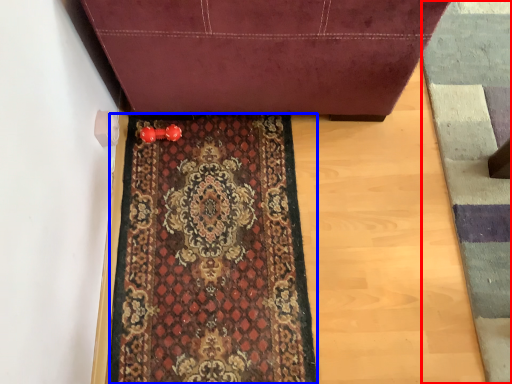
Question: Which object is further to the camera taking this photo, doormat (highlighted by a red box) or mat (highlighted by a blue box)?

Choices:
 (A) doormat
 (B) mat

Answer: (B)